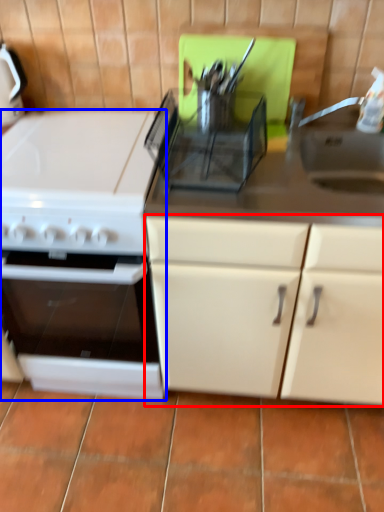
Question: Which of the following is the farthest to the observer, cabinetry (highlighted by a red box) or kitchen appliance (highlighted by a blue box)?

Choices:
 (A) cabinetry
 (B) kitchen appliance

Answer: (B)